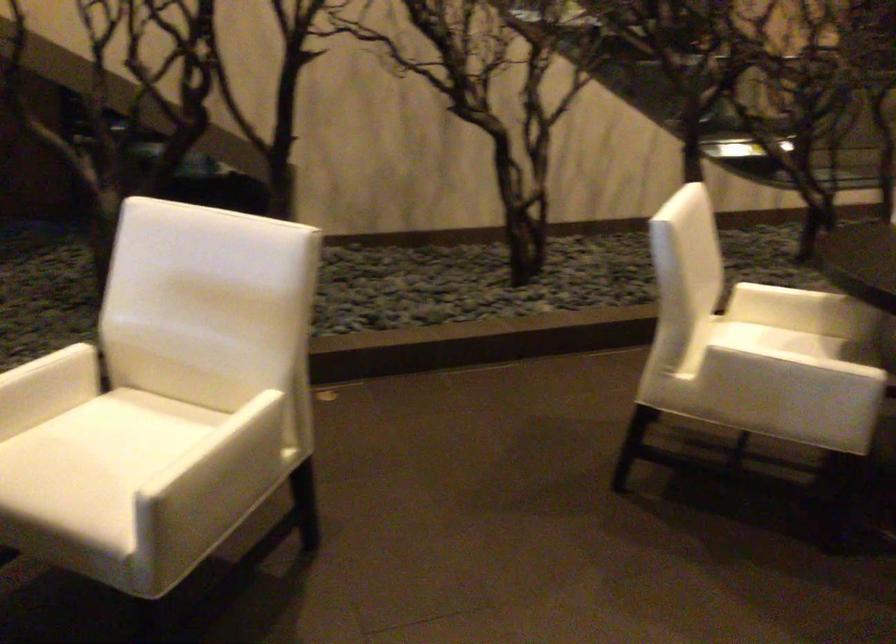
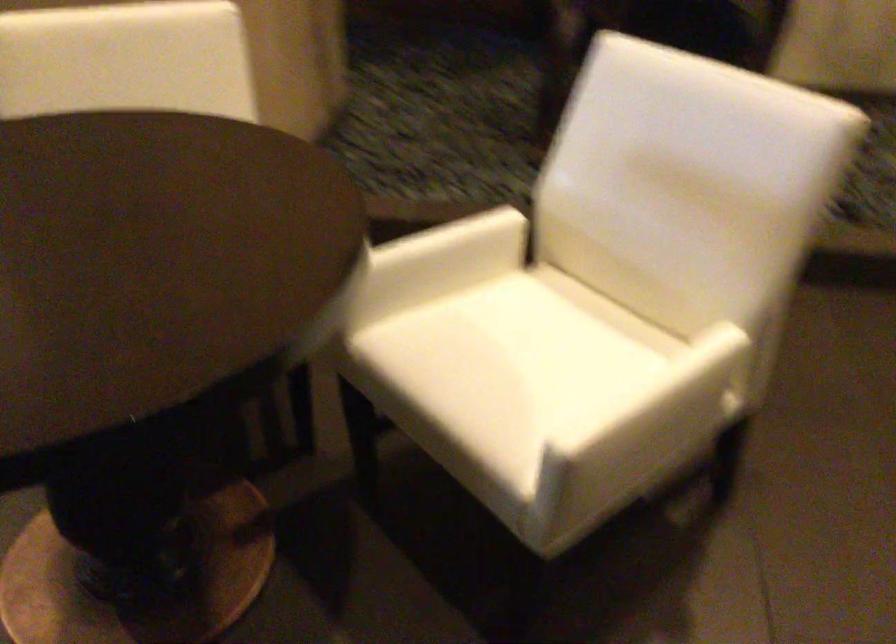
Question: The camera is either moving clockwise (left) or counter-clockwise (right) around the object. The first image is from the beginning of the video and the second image is from the end. Is the camera moving left or right when shooting the video?

Choices:
 (A) Left
 (B) Right

Answer: (B)